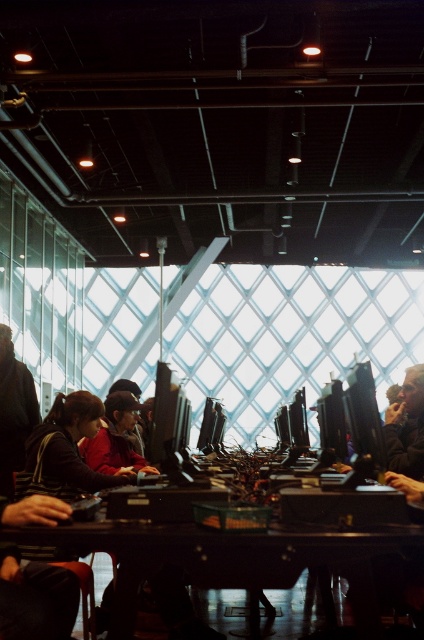
Is the position of dark wood table at center less distant than that of red fabric jacket at center?

Yes, it is in front of red fabric jacket at center.

Which is more to the left, dark wood table at center or red fabric jacket at center?

red fabric jacket at center is more to the left.

What do you see at coordinates (233, 556) in the screenshot? I see `dark wood table at center` at bounding box center [233, 556].

Locate an element on the screen. This screenshot has height=640, width=424. dark wood table at center is located at coordinates (233, 556).

Where is `dark wood table at center`? The width and height of the screenshot is (424, 640). dark wood table at center is located at coordinates (233, 556).

Between point (357, 554) and point (5, 344), which one is positioned in front?

Point (357, 554)

Locate an element on the screen. This screenshot has height=640, width=424. dark wood table at center is located at coordinates (233, 556).

The image size is (424, 640). In order to click on matte black jacket at center in this screenshot , I will do `click(66, 451)`.

Locate an element on the screen. Image resolution: width=424 pixels, height=640 pixels. matte black jacket at center is located at coordinates (66, 451).